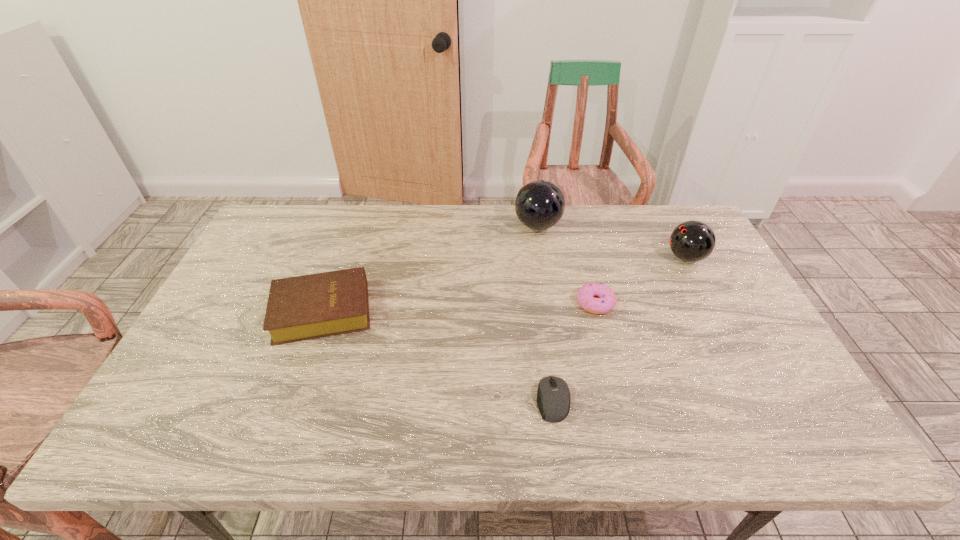
The height and width of the screenshot is (540, 960). Find the location of `vacant space in between the nearer bowling ball and the Bible`. vacant space in between the nearer bowling ball and the Bible is located at coordinates (504, 284).

The image size is (960, 540). What are the coordinates of `vacant region between the third shortest object and the nearest object` in the screenshot? It's located at (437, 355).

At what (x,y) coordinates should I click in order to perform the action: click on vacant point located between the third tallest object and the second farthest object. Please return your answer as a coordinate pair (x, y). Looking at the image, I should click on (504, 284).

Where is `free point between the nearest object and the second shortest object`? free point between the nearest object and the second shortest object is located at coordinates (574, 352).

What are the coordinates of `vacant region between the third shortest object and the right bowling ball` in the screenshot? It's located at (504, 284).

The width and height of the screenshot is (960, 540). I want to click on free space between the leftmost object and the computer equipment, so click(x=437, y=355).

I want to click on free space that is in between the farthest object and the doughnut, so click(x=566, y=265).

Where is `empty space that is in between the shortest object and the third shortest object`? empty space that is in between the shortest object and the third shortest object is located at coordinates (437, 355).

Locate an element on the screen. Image resolution: width=960 pixels, height=540 pixels. object that is the fourth closest to the taller bowling ball is located at coordinates (553, 396).

Locate which object ranks third in proximity to the shortest object. Please provide its 2D coordinates. Your answer should be formatted as a tuple, i.e. [(x, y)], where the tuple contains the x and y coordinates of a point satisfying the conditions above.

[(539, 205)]